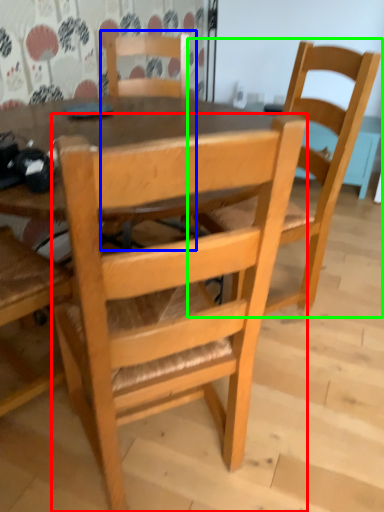
Question: Which is nearer to the chair (highlighted by a red box)? chair (highlighted by a blue box) or chair (highlighted by a green box).

Choices:
 (A) chair
 (B) chair

Answer: (B)